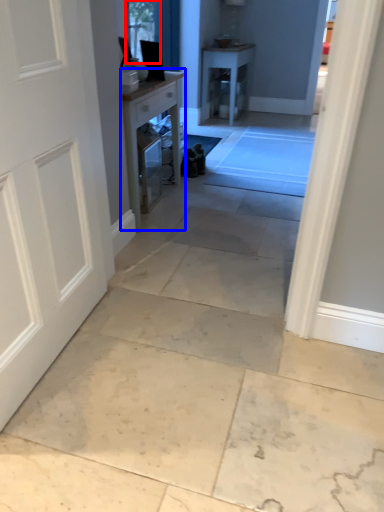
Question: Among these objects, which one is nearest to the camera, window screen (highlighted by a red box) or table (highlighted by a blue box)?

Choices:
 (A) window screen
 (B) table

Answer: (B)